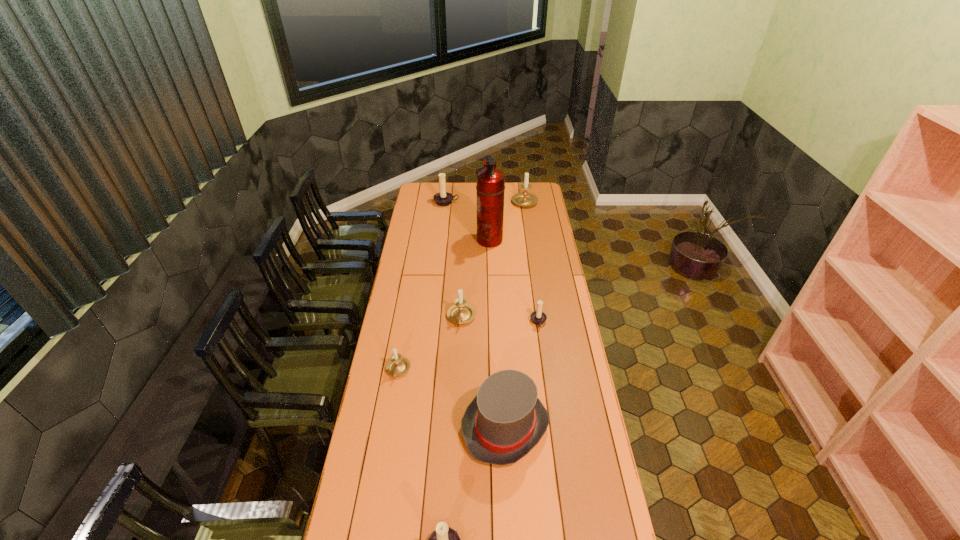
I want to click on red fire extinguisher, so click(x=490, y=187).

At what (x,y) coordinates should I click in order to perform the action: click on the tallest object. Please return your answer as a coordinate pair (x, y). The image size is (960, 540). Looking at the image, I should click on (490, 187).

Find the location of a particular element. the farthest beige candle holder is located at coordinates (524, 198).

Find the location of `the rightmost beige candle holder`. the rightmost beige candle holder is located at coordinates (524, 198).

Locate an element on the screen. This screenshot has height=540, width=960. the biggest brown candle holder is located at coordinates (443, 198).

The width and height of the screenshot is (960, 540). Identify the location of the second nearest object. (505, 421).

At what (x,y) coordinates should I click in order to perform the action: click on gray dress hat. Please return your answer as a coordinate pair (x, y). Looking at the image, I should click on (505, 421).

Where is `the second farthest beige candle holder`? the second farthest beige candle holder is located at coordinates (x=461, y=312).

What are the coordinates of `the second beige candle holder from left to right` in the screenshot? It's located at (461, 312).

You are a GUI agent. You are given a task and a screenshot of the screen. Output one action in this format:
    pyautogui.click(x=<x>, y=<y>)
    Task: Click on the leftmost beige candle holder
    Image resolution: width=960 pixels, height=540 pixels.
    Given the screenshot: What is the action you would take?
    pyautogui.click(x=397, y=365)